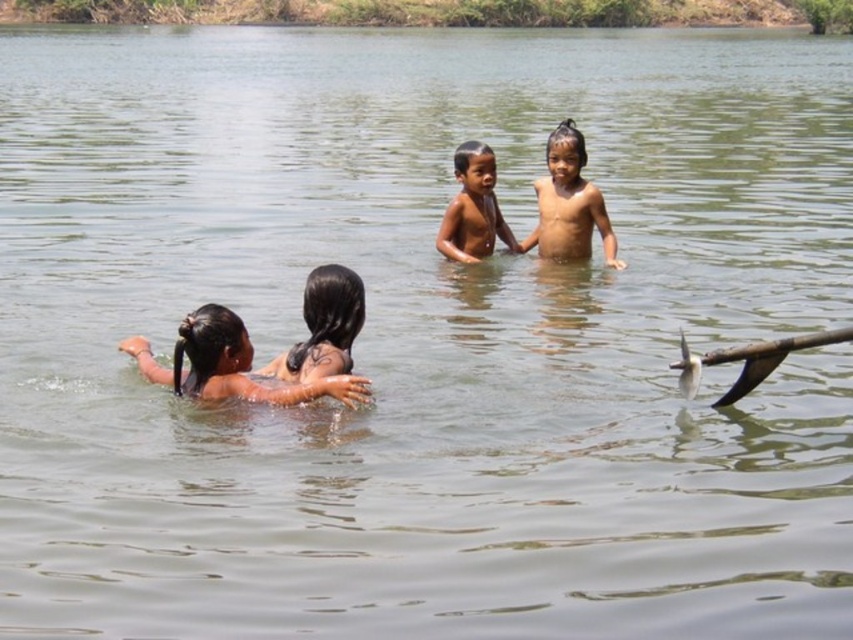
Who is shorter, dark skin/soft hair at center or dark brown hair at center?

dark brown hair at center

Is dark skin/soft hair at center smaller than dark brown hair at center?

No.

Between point (149, 349) and point (351, 285), which one is positioned in front?

Point (351, 285) is more forward.

This screenshot has width=853, height=640. I want to click on dark skin/soft hair at center, so click(231, 364).

The width and height of the screenshot is (853, 640). Describe the element at coordinates (323, 326) in the screenshot. I see `dark brown hair at center` at that location.

Between point (305, 356) and point (477, 166), which one is positioned behind?

The point (477, 166) is more distant.

Which is behind, point (317, 358) or point (492, 161)?

Point (492, 161)

This screenshot has width=853, height=640. I want to click on dark brown hair at center, so click(x=323, y=326).

Who is more distant from viewer, (584, 214) or (492, 244)?

Point (492, 244)

Is brown skin child at upper center to the right of brown skin child at center from the viewer's perspective?

Yes, brown skin child at upper center is to the right of brown skin child at center.

Between point (576, 140) and point (471, 172), which one is positioned in front?

Point (576, 140)

Locate an element on the screen. brown skin child at upper center is located at coordinates (569, 204).